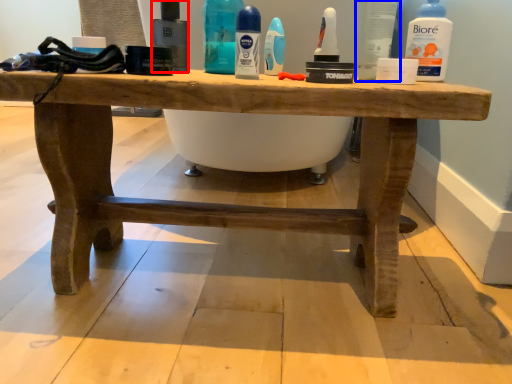
Question: Among these objects, which one is nearest to the camera, mouthwash (highlighted by a red box) or toiletry (highlighted by a blue box)?

Choices:
 (A) mouthwash
 (B) toiletry

Answer: (B)